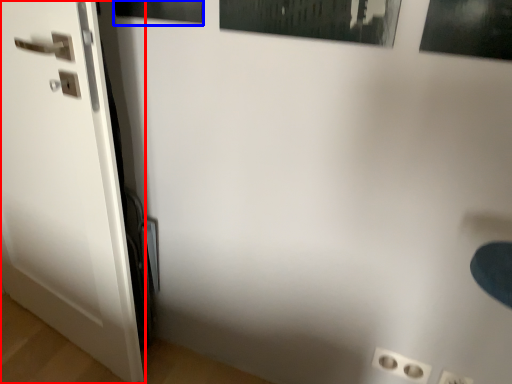
Question: Which object appears closest to the camera in this image, door (highlighted by a red box) or picture frame (highlighted by a blue box)?

Choices:
 (A) door
 (B) picture frame

Answer: (A)